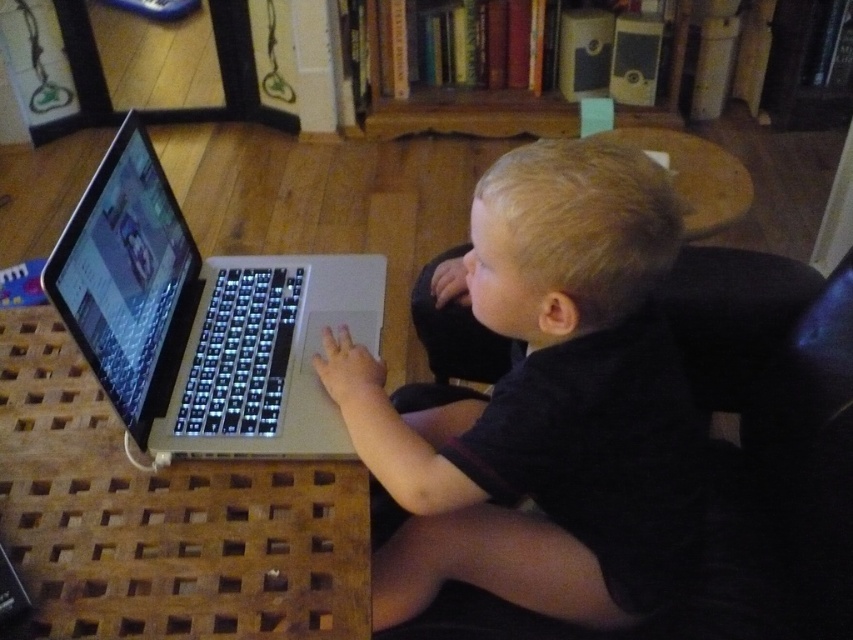
You are a parent trying to ensure your child can see the laptop screen clearly. Based on the scene, is the silver metallic laptop at lower left positioned closer to the child than the wooden bookshelf at upper center?

Yes, the silver metallic laptop at lower left is in front of the wooden bookshelf at upper center, meaning it is closer to the child and thus easier to see the screen.

What is the exact coordinate position of the black matte laptop at lower left on the image?

The black matte laptop at lower left is located at point coordinates of 0.631 and 0.639.

You are a robot trying to navigate to the blue object in the scene. The robot can only move forward and backward along a straight line. There are two points marked in the scene, point A at coordinates point (554, 593) and point B at coordinates point (302, 301). Which point should you move towards to reach the blue object without any obstacles?

Point A at coordinates point (554, 593) is in front of point B at coordinates point (302, 301), so moving towards point A would be the correct path to reach the blue object without obstacles.